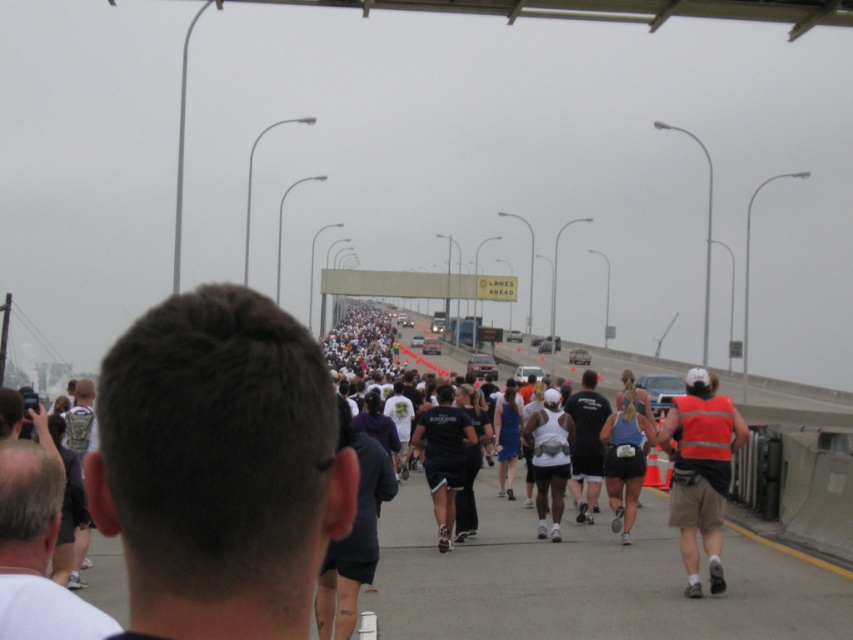
Can you confirm if reflective orange vest at right is positioned to the right of black fabric shirt at center?

Indeed, reflective orange vest at right is positioned on the right side of black fabric shirt at center.

Is reflective orange vest at right to the left of black fabric shirt at center from the viewer's perspective?

No, reflective orange vest at right is not to the left of black fabric shirt at center.

This screenshot has width=853, height=640. What do you see at coordinates (700, 472) in the screenshot? I see `reflective orange vest at right` at bounding box center [700, 472].

You are a GUI agent. You are given a task and a screenshot of the screen. Output one action in this format:
    pyautogui.click(x=<x>, y=<y>)
    Task: Click on the reflective orange vest at right
    
    Given the screenshot: What is the action you would take?
    (700, 472)

Is black fabric shirt at center positioned before blue fabric tank top at center?

No.

Between black fabric shirt at center and blue fabric tank top at center, which one appears on the left side from the viewer's perspective?

Positioned to the left is black fabric shirt at center.

Is point (424, 465) positioned after point (624, 508)?

Yes, point (424, 465) is farther from viewer.

Identify the location of black fabric shirt at center. Image resolution: width=853 pixels, height=640 pixels. (444, 456).

Is point (700, 468) positioned behind point (637, 397)?

No.

Which is more to the left, reflective orange vest at right or blue fabric tank top at center?

Positioned to the left is blue fabric tank top at center.

Is point (721, 483) behind point (622, 464)?

No, it is not.

This screenshot has width=853, height=640. What are the coordinates of `reflective orange vest at right` in the screenshot? It's located at (700, 472).